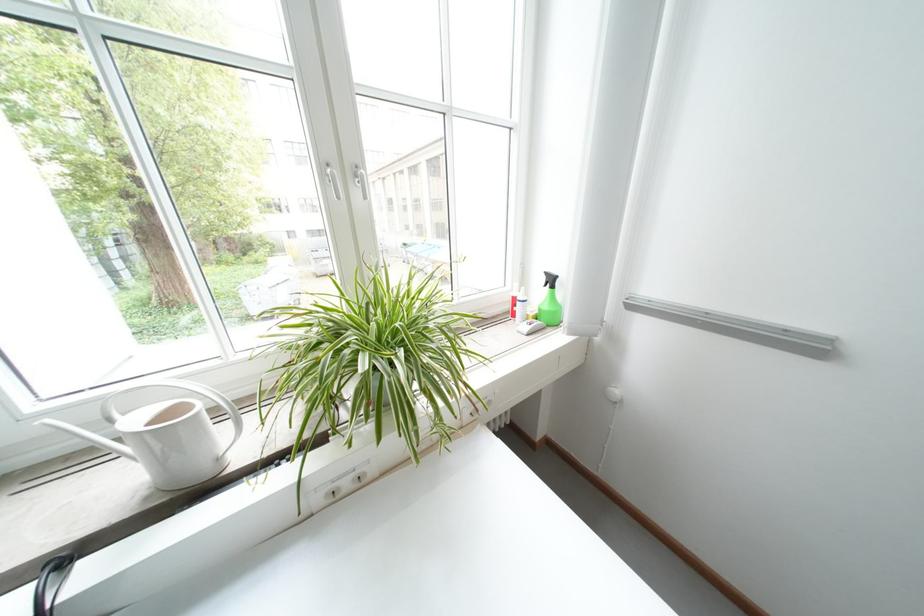
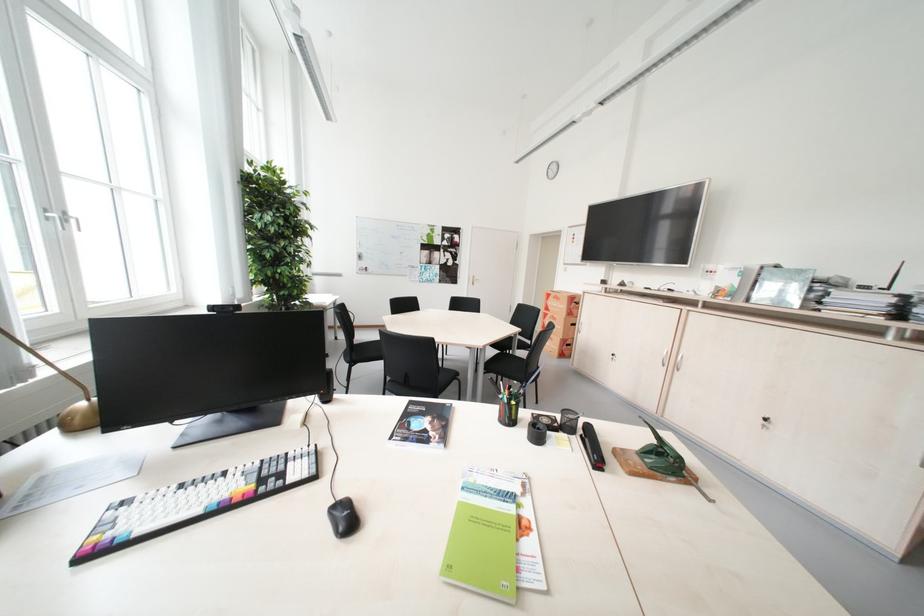
Question: I am providing you with two images of the same scene from different viewpoints. Which of the following objects are not visible in image2?

Choices:
 (A) black pen
 (B) green paper booklet
 (C) white remote control
 (D) pink plastic crate

Answer: (C)